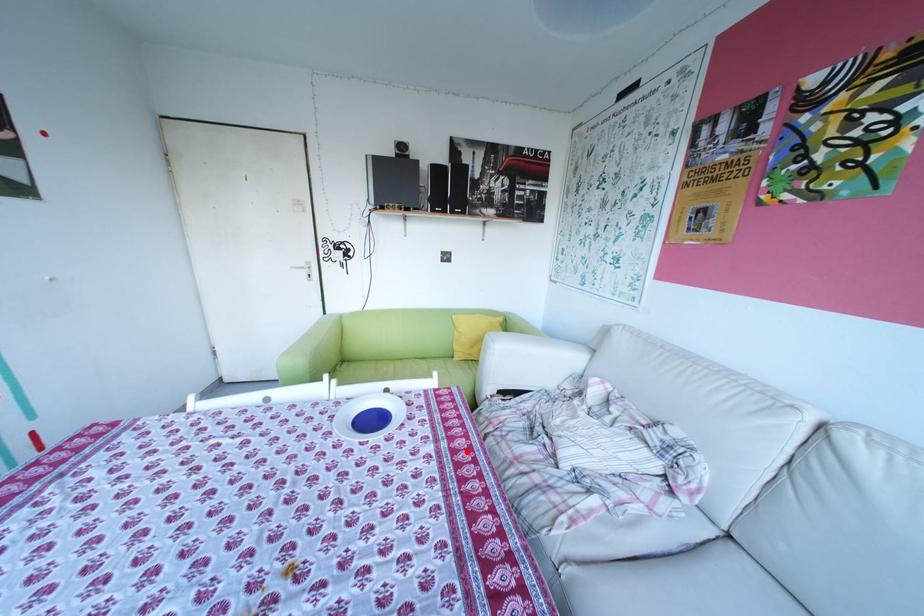
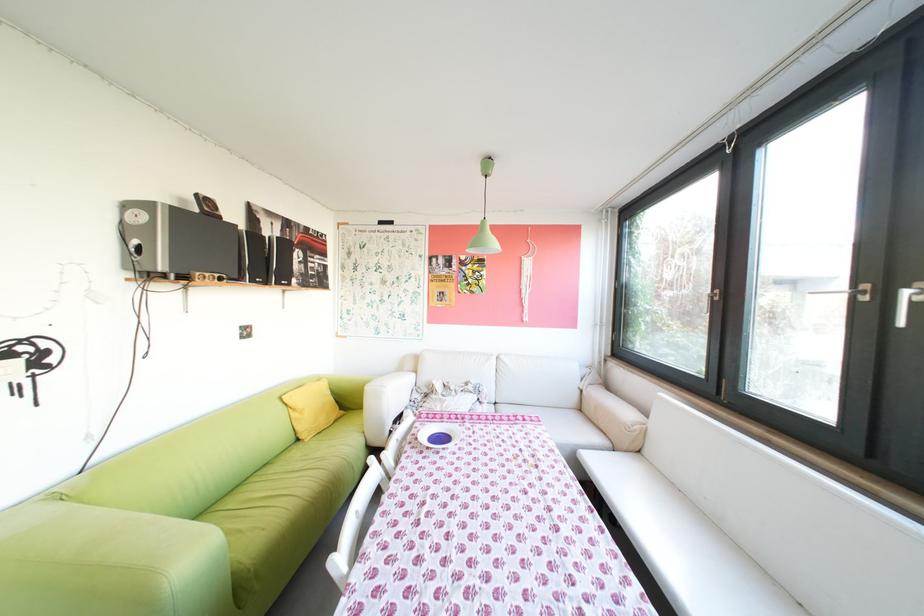
Question: I am providing you with two images of the same scene from different viewpoints. In image1, a red point is highlighted. Considering the same 3D point in image2, which of the following is correct?

Choices:
 (A) It is closer
 (B) It is farther

Answer: (A)